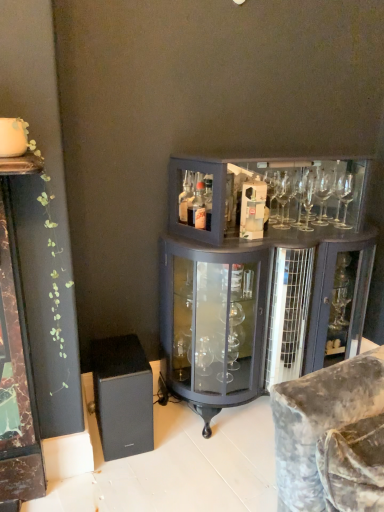
You are a GUI agent. You are given a task and a screenshot of the screen. Output one action in this format:
    pyautogui.click(x=<x>, y=<y>)
    Task: Click on the free spot above black matte speaker at lower left (from a real-world perspective)
    The image size is (384, 512).
    Given the screenshot: What is the action you would take?
    pyautogui.click(x=124, y=351)